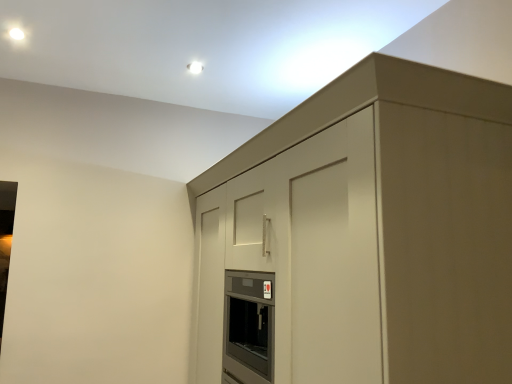
At what (x,y) coordinates should I click in order to perform the action: click on matte gray cupboard at upper right. Please return your answer as a coordinate pair (x, y). This screenshot has height=384, width=512. Looking at the image, I should click on (393, 179).

What do you see at coordinates (393, 179) in the screenshot?
I see `matte gray cupboard at upper right` at bounding box center [393, 179].

Find the location of a particular element. matte gray cupboard at upper right is located at coordinates (393, 179).